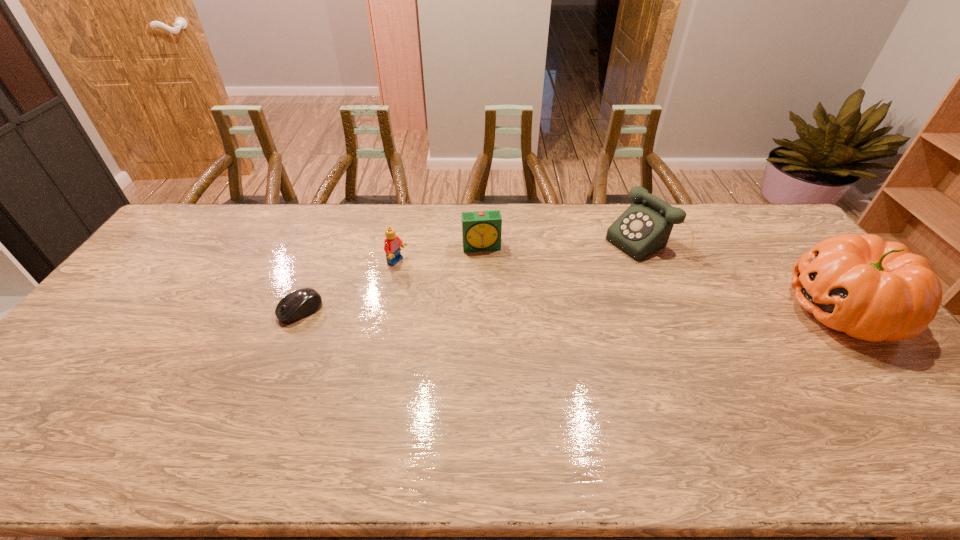
The height and width of the screenshot is (540, 960). What are the coordinates of `the leftmost object` in the screenshot? It's located at (303, 302).

At what (x,y) coordinates should I click in order to perform the action: click on the shortest object. Please return your answer as a coordinate pair (x, y). Looking at the image, I should click on (303, 302).

What are the coordinates of `the rightmost object` in the screenshot? It's located at (872, 290).

I want to click on the tallest object, so click(x=872, y=290).

The image size is (960, 540). Find the location of `the third object from left to right`. the third object from left to right is located at coordinates (481, 230).

Where is `the second tallest object`? This screenshot has height=540, width=960. the second tallest object is located at coordinates (645, 226).

Where is `telephone`? telephone is located at coordinates (645, 226).

Where is `the fourth object from right to left`? the fourth object from right to left is located at coordinates (392, 244).

You are a GUI agent. You are given a task and a screenshot of the screen. Output one action in this format:
    pyautogui.click(x=<x>, y=<y>)
    Task: Click on the vacant region located on the back of the mouse
    The height and width of the screenshot is (540, 960).
    Given the screenshot: What is the action you would take?
    pyautogui.click(x=324, y=254)

Image resolution: width=960 pixels, height=540 pixels. I want to click on free space located 0.370m on the carved face of the rightmost object, so click(x=660, y=310).